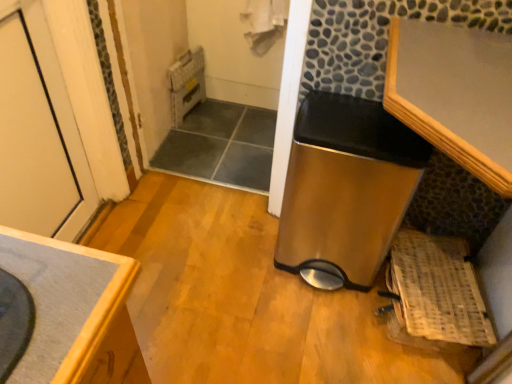
In order to click on free space that is in between stainless steel trash can at center, the 1th water heater positioned from the right, and woven wood basket at lower right in this screenshot , I will do `click(330, 311)`.